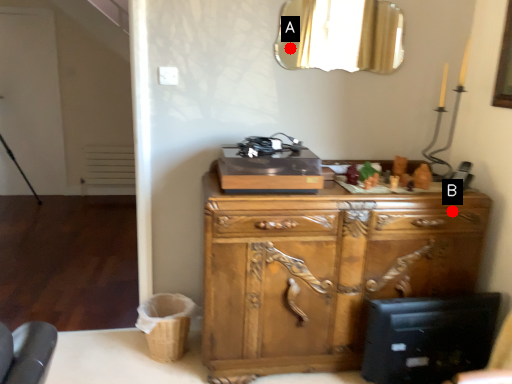
Question: Two points are circled on the image, labeled by A and B beside each circle. Which of the following is the closest to the observer?

Choices:
 (A) A is closer
 (B) B is closer

Answer: (B)